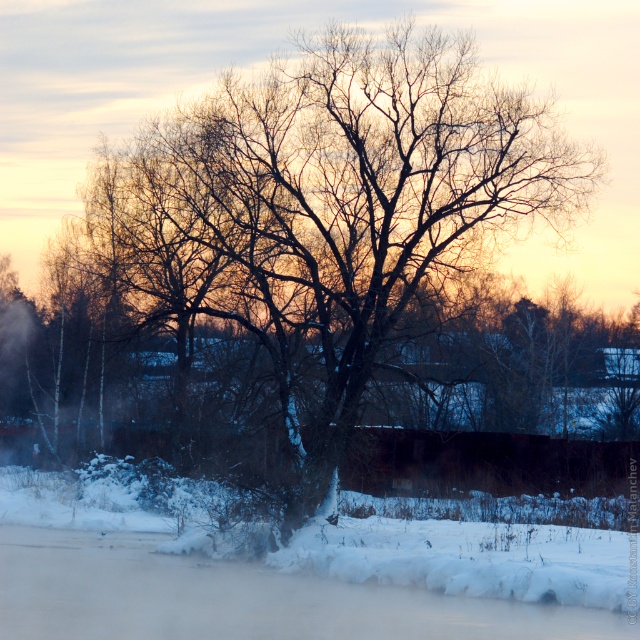
Between bare branches at center and white fluffy snow at lower center, which one appears on the left side from the viewer's perspective?

white fluffy snow at lower center is more to the left.

Does point (125, 209) lie behind point (314, 605)?

That is True.

Where is `bare branches at center`? This screenshot has height=640, width=640. bare branches at center is located at coordinates (307, 236).